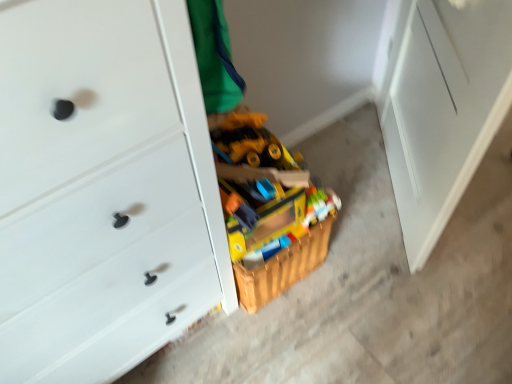
Question: Can you confirm if wooden toy box at center is shorter than white matte file cabinet at right?

Choices:
 (A) no
 (B) yes

Answer: (B)

Question: Is wooden toy box at center with white matte file cabinet at right?

Choices:
 (A) yes
 (B) no

Answer: (B)

Question: Is wooden toy box at center oriented away from white matte file cabinet at right?

Choices:
 (A) yes
 (B) no

Answer: (B)

Question: Are wooden toy box at center and white matte file cabinet at right far apart?

Choices:
 (A) no
 (B) yes

Answer: (A)

Question: Is wooden toy box at center positioned behind white matte file cabinet at right?

Choices:
 (A) yes
 (B) no

Answer: (A)

Question: Is wooden toy box at center aimed at white matte file cabinet at right?

Choices:
 (A) yes
 (B) no

Answer: (B)

Question: Is white matte chest of drawers at center located outside wooden toy box at center?

Choices:
 (A) yes
 (B) no

Answer: (A)

Question: Can you confirm if white matte chest of drawers at center is taller than wooden toy box at center?

Choices:
 (A) no
 (B) yes

Answer: (B)

Question: Does white matte chest of drawers at center lie behind wooden toy box at center?

Choices:
 (A) yes
 (B) no

Answer: (B)

Question: Is wooden toy box at center located within white matte chest of drawers at center?

Choices:
 (A) no
 (B) yes

Answer: (A)

Question: Is white matte chest of drawers at center at the right side of wooden toy box at center?

Choices:
 (A) no
 (B) yes

Answer: (A)

Question: Considering the relative sizes of white matte chest of drawers at center and wooden toy box at center in the image provided, is white matte chest of drawers at center wider than wooden toy box at center?

Choices:
 (A) yes
 (B) no

Answer: (A)

Question: From the image's perspective, would you say white matte file cabinet at right is shown under wooden toy box at center?

Choices:
 (A) yes
 (B) no

Answer: (B)